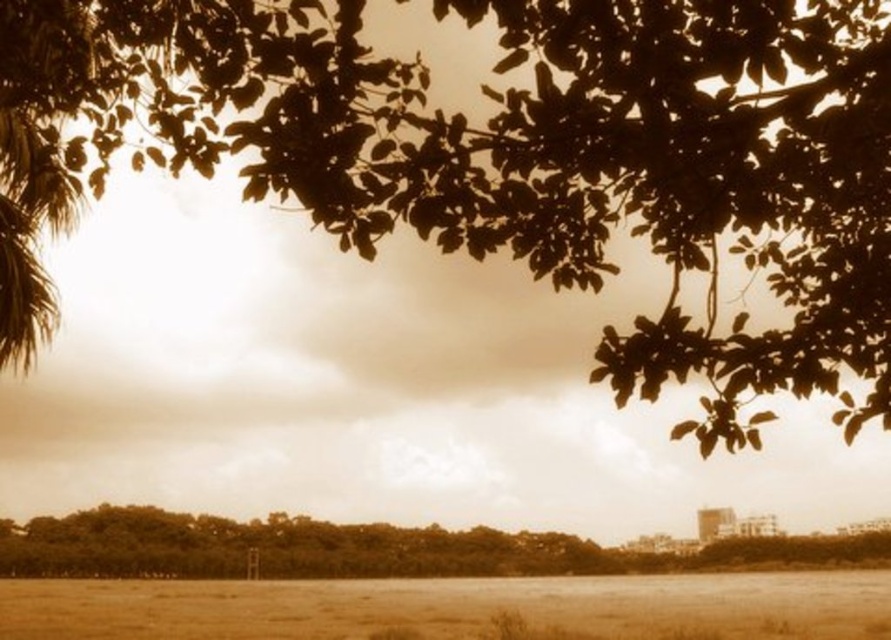
You are planning to place a small garden bench in the scene. The bench requires a space wider than the brown leafy tree at lower center. Can the brown grass at lower center provide enough space for the bench?

The brown grass at lower center might be wider than the brown leafy tree at lower center, so it could potentially provide enough space for the bench if the grass area is indeed wider.

You are standing in the middle of the field looking at the scene. Which object, the brown leafy branches at upper center or the brown grass at lower center, is located above the other?

The brown leafy branches at upper center is positioned over brown grass at lower center.

Looking at this image, you are standing in the serene outdoor scene and want to walk from the point closer to you to the farther point. Which path would you take between the two points, point (316, 84) and point (503, 531)?

The path from point (316, 84) to point (503, 531) would be the correct route since point (316, 84) is closer to the viewer and you need to move towards the farther point (503, 531).